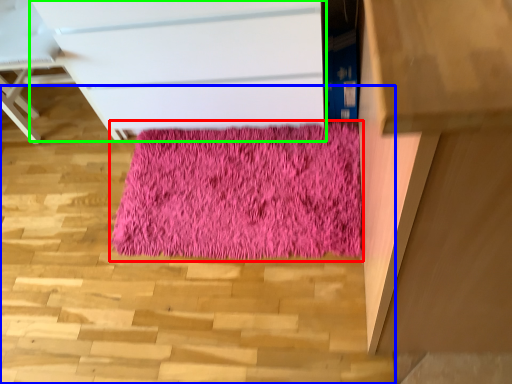
Question: Which is farther away from mat (highlighted by a red box)? stairwell (highlighted by a blue box) or chest of drawers (highlighted by a green box)?

Choices:
 (A) stairwell
 (B) chest of drawers

Answer: (B)